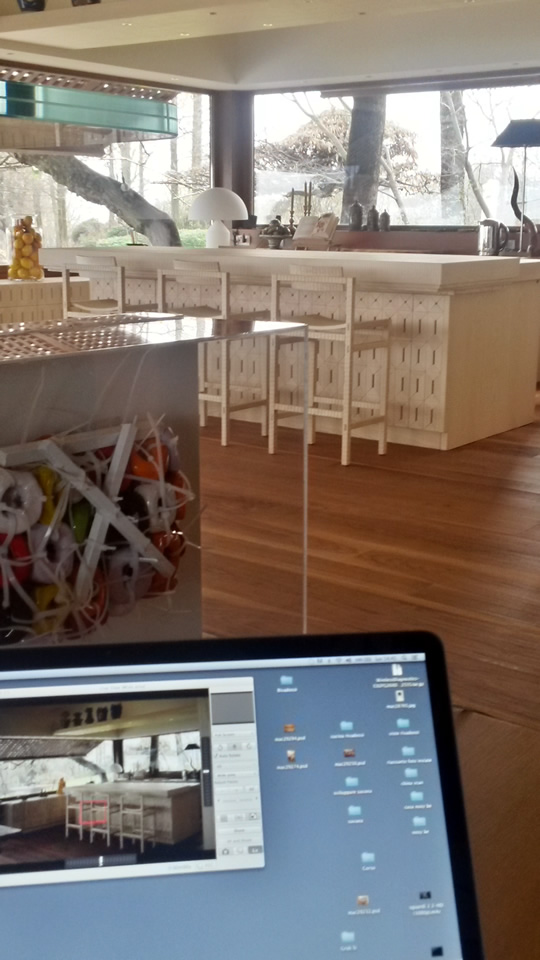
Where is `picture on the laptop`? picture on the laptop is located at coordinates (90, 776).